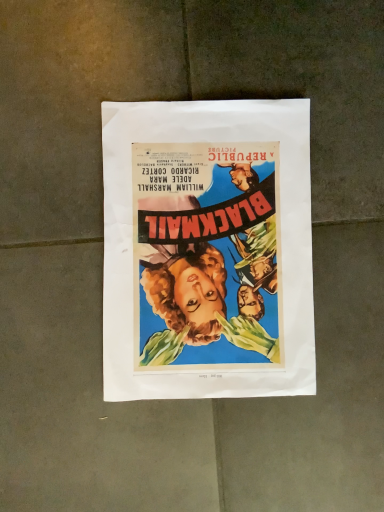
At what (x,y) coordinates should I click in order to perform the action: click on blank space situated above matte paper poster at center (from a real-world perspective). Please return your answer as a coordinate pair (x, y). This screenshot has height=512, width=384. Looking at the image, I should click on (205, 256).